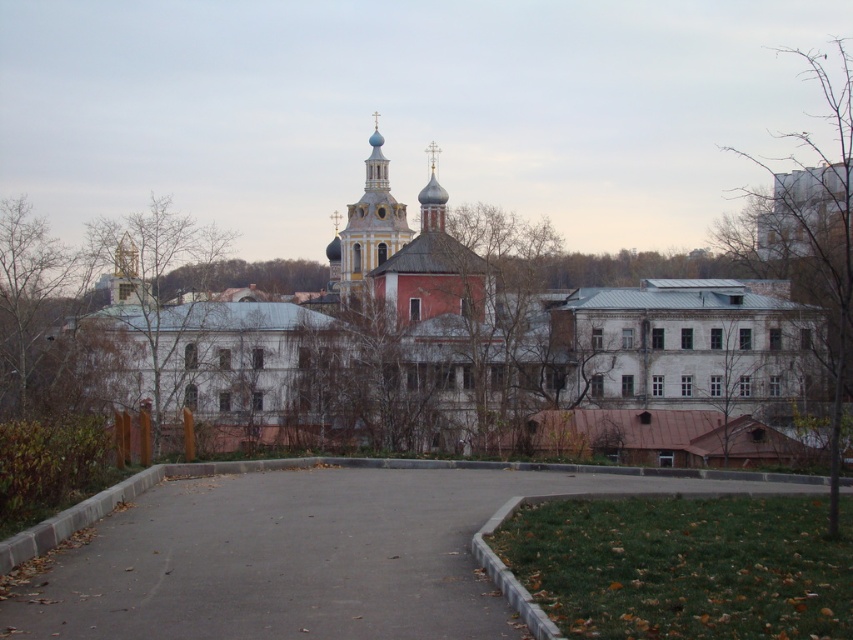
You are an architect analyzing the layout of this urban space. You need to determine the spatial relationship between the brown wooden tree at center and the gold textured dome at center. Which object is located to the right of the other?

The brown wooden tree at center is positioned on the right side of gold textured dome at center, so the brown wooden tree at center is to the right of the gold textured dome at center.

You are standing at the origin point of the image coordinate system, which is the bottom left corner. You want to walk towards the brown wooden tree at center. In which direction should you move first? Choose from up, down, left, or right.

The brown wooden tree at center is located at point (729, 369). Since the origin is the bottom left corner, moving right increases the x coordinate and moving up increases the y coordinate. To reach the tree, you should first move right to increase the x value from 0 to 0.577 and then move up to increase the y value from 0 to 0.856. However, since the question asks for the first direction, the immediate direction to start moving is right.

You are standing in the urban landscape and want to take a photo of the gold textured dome at center without the brown wooden tree at center blocking the view. Which direction should you move to ensure the tree is out of frame?

Move upwards or towards the gold textured dome at center to position yourself above the brown wooden tree at center, ensuring it doesn